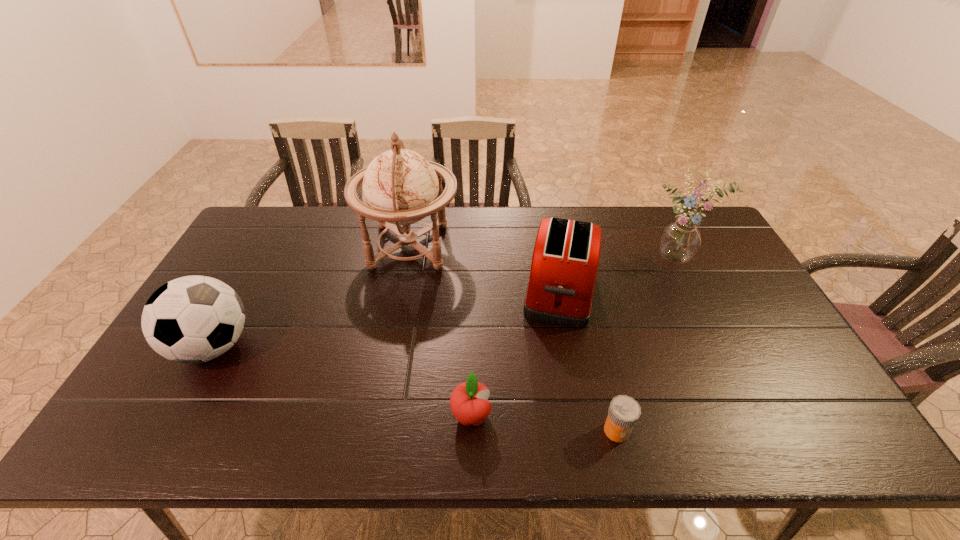
Image resolution: width=960 pixels, height=540 pixels. What are the coordinates of `the fifth object from right to left` in the screenshot? It's located at (401, 187).

Locate an element on the screen. the tallest object is located at coordinates (401, 187).

This screenshot has width=960, height=540. I want to click on the second tallest object, so click(680, 240).

Locate an element on the screen. This screenshot has height=540, width=960. bouquet is located at coordinates (680, 240).

I want to click on toaster, so click(x=565, y=260).

I want to click on the leftmost object, so click(x=193, y=319).

You are a GUI agent. You are given a task and a screenshot of the screen. Output one action in this format:
    pyautogui.click(x=<x>, y=<y>)
    Task: Click on the second shortest object
    
    Given the screenshot: What is the action you would take?
    pyautogui.click(x=468, y=402)

Locate an element on the screen. The width and height of the screenshot is (960, 540). apple is located at coordinates (468, 402).

Locate an element on the screen. medicine is located at coordinates (624, 411).

Image resolution: width=960 pixels, height=540 pixels. In order to click on blank space located 0.290m at the front of the globe showing Africa in this screenshot , I will do `click(545, 246)`.